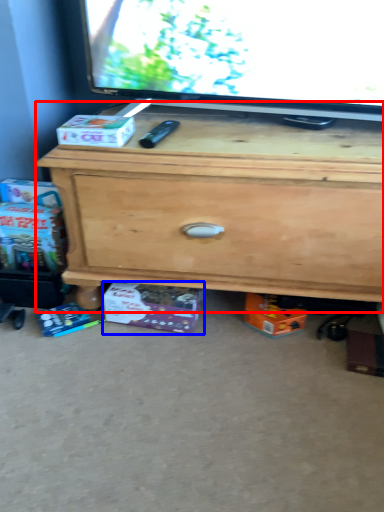
Question: Which object appears closest to the camera in this image, chest of drawers (highlighted by a red box) or box (highlighted by a blue box)?

Choices:
 (A) chest of drawers
 (B) box

Answer: (A)